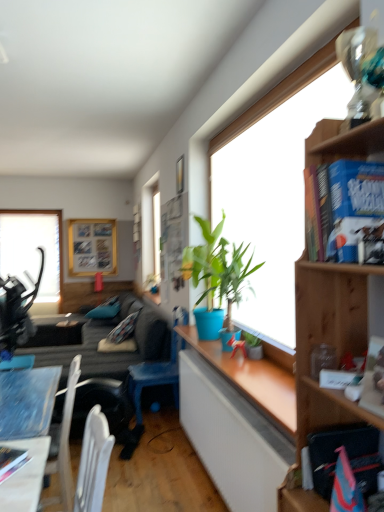
How much space does green matte plant at window, which is the second houseplant in top-to-bottom order, occupy vertically?

green matte plant at window, which is the second houseplant in top-to-bottom order, is 5.70 inches tall.

You are a GUI agent. You are given a task and a screenshot of the screen. Output one action in this format:
    pyautogui.click(x=<x>, y=<y>)
    Task: Click on the blue hardcover book at upper right, which is the 1th book from front to back
    
    Given the screenshot: What is the action you would take?
    pyautogui.click(x=354, y=202)

This screenshot has width=384, height=512. Identify the location of blue plastic chair at lower center. (155, 376).

This screenshot has height=512, width=384. I want to click on wooden desk at lower left, so click(26, 429).

This screenshot has height=512, width=384. What are the coordinates of `green matte plant at window, positioned as the 1th houseplant in bottom-to-top order` in the screenshot? It's located at (253, 346).

Considering the relative sizes of blue matte plant at center, marked as the second houseplant in a bottom-to-top arrangement, and dark gray fabric couch at lower left in the image provided, is blue matte plant at center, marked as the second houseplant in a bottom-to-top arrangement, wider than dark gray fabric couch at lower left?

No.

In the scene shown: Is blue matte plant at center, arranged as the second houseplant when viewed from the back, behind dark gray fabric couch at lower left?

No, blue matte plant at center, arranged as the second houseplant when viewed from the back, is in front of dark gray fabric couch at lower left.

Is blue matte plant at center, positioned as the 1th houseplant in top-to-bottom order, not near dark gray fabric couch at lower left?

Yes, blue matte plant at center, positioned as the 1th houseplant in top-to-bottom order, and dark gray fabric couch at lower left are quite far apart.

Is dark gray fabric couch at lower left spatially inside green matte plant at window, positioned as the 1th houseplant in bottom-to-top order, or outside of it?

dark gray fabric couch at lower left exists outside the volume of green matte plant at window, positioned as the 1th houseplant in bottom-to-top order.

Considering the sizes of objects dark gray fabric couch at lower left and green matte plant at window, which appears as the first houseplant when viewed from the back, in the image provided, who is bigger, dark gray fabric couch at lower left or green matte plant at window, which appears as the first houseplant when viewed from the back,?

Bigger between the two is dark gray fabric couch at lower left.

From a real-world perspective, is dark gray fabric couch at lower left over green matte plant at window, which is the second houseplant in top-to-bottom order?

No, from a real-world perspective, dark gray fabric couch at lower left is not above green matte plant at window, which is the second houseplant in top-to-bottom order.

You are a GUI agent. You are given a task and a screenshot of the screen. Output one action in this format:
    pyautogui.click(x=<x>, y=<y>)
    Task: Click on the 1st houseplant in front when counting from the dark gray fabric couch at lower left
    This screenshot has width=384, height=512.
    Given the screenshot: What is the action you would take?
    pyautogui.click(x=253, y=346)

Who is taller, transparent glass window at upper left or blue matte plant at center, placed as the first houseplant when sorted from front to back?

Standing taller between the two is transparent glass window at upper left.

Is blue matte plant at center, arranged as the second houseplant when viewed from the back, at the back of transparent glass window at upper left?

No.

Is transparent glass window at upper left at the right side of blue matte plant at center, positioned as the 1th houseplant in top-to-bottom order?

Incorrect, transparent glass window at upper left is not on the right side of blue matte plant at center, positioned as the 1th houseplant in top-to-bottom order.

Looking at this image, from a real-world perspective, is wooden picture frame at upper left beneath wooden desk at lower left?

Incorrect, from a real-world perspective, wooden picture frame at upper left is higher than wooden desk at lower left.

Which object is further away from the camera taking this photo, wooden picture frame at upper left or wooden desk at lower left?

wooden picture frame at upper left.

Considering the positions of objects wooden picture frame at upper left and wooden desk at lower left in the image provided, who is more to the left, wooden picture frame at upper left or wooden desk at lower left?

From the viewer's perspective, wooden picture frame at upper left appears more on the left side.

Is hardcover book at lower left, which ranks as the third book in front-to-back order, a part of wooden picture frame at upper left?

Definitely not — hardcover book at lower left, which ranks as the third book in front-to-back order, is not inside wooden picture frame at upper left.

Could you tell me if wooden picture frame at upper left is facing hardcover book at lower left, the 3th book viewed from the top?

Yes, wooden picture frame at upper left is facing hardcover book at lower left, the 3th book viewed from the top.

From a real-world perspective, is wooden picture frame at upper left on top of hardcover book at lower left, the 3th book from the right?

Yes, from a real-world perspective, wooden picture frame at upper left is over hardcover book at lower left, the 3th book from the right

Which is behind, wooden picture frame at upper left or hardcover book at lower left, the 3th book from the right?

wooden picture frame at upper left.

Who is smaller, wooden picture frame at upper left or blue plastic chair at lower center?

With smaller size is wooden picture frame at upper left.

Does wooden picture frame at upper left appear on the left side of blue plastic chair at lower center?

Yes, wooden picture frame at upper left is to the left of blue plastic chair at lower center.

Is blue plastic chair at lower center at the back of wooden picture frame at upper left?

No, blue plastic chair at lower center is not at the back of wooden picture frame at upper left.

Considering the positions of objects wooden desk at lower left and green matte plant at window, the 2th houseplant when ordered from front to back, in the image provided, who is behind, wooden desk at lower left or green matte plant at window, the 2th houseplant when ordered from front to back,?

green matte plant at window, the 2th houseplant when ordered from front to back, is more distant.

Consider the image. Does wooden desk at lower left appear on the right side of green matte plant at window, positioned as the 1th houseplant in bottom-to-top order?

In fact, wooden desk at lower left is to the left of green matte plant at window, positioned as the 1th houseplant in bottom-to-top order.

From the image's perspective, is wooden desk at lower left positioned above or below green matte plant at window, which appears as the first houseplant when viewed from the back?

wooden desk at lower left is situated lower than green matte plant at window, which appears as the first houseplant when viewed from the back, in the image.

From a real-world perspective, is wooden desk at lower left on green matte plant at window, positioned as the 1th houseplant in bottom-to-top order?

No, from a real-world perspective, wooden desk at lower left is not above green matte plant at window, positioned as the 1th houseplant in bottom-to-top order.

Find the location of a particular element. The width and height of the screenshot is (384, 512). studio couch on the left of blue matte plant at center, arranged as the second houseplant when viewed from the back is located at coordinates (99, 341).

At what (x,y) coordinates should I click in order to perform the action: click on the 1st houseplant in front of the dark gray fabric couch at lower left, starting your count from the anchor. Please return your answer as a coordinate pair (x, y). Looking at the image, I should click on (253, 346).

Looking at the image, which one is located closer to blue plastic chair at lower center, blue matte plant at center, marked as the second houseplant in a bottom-to-top arrangement, or dark gray fabric couch at lower left?

The object closer to blue plastic chair at lower center is dark gray fabric couch at lower left.

Looking at the image, which one is located further to wooden picture frame at upper left, blue matte plant at center, placed as the first houseplant when sorted from front to back, or hardcover book at center-right, which ranks as the third book in left-to-right order?

Among the two, hardcover book at center-right, which ranks as the third book in left-to-right order, is located further to wooden picture frame at upper left.

In the scene shown: Based on their spatial positions, is green matte plant at window, which is the second houseplant in top-to-bottom order, or transparent glass window at upper left closer to blue matte plant at center, marked as the second houseplant in a bottom-to-top arrangement?

The object closer to blue matte plant at center, marked as the second houseplant in a bottom-to-top arrangement, is green matte plant at window, which is the second houseplant in top-to-bottom order.

When comparing their distances from blue hardcover book at upper right, which is the 1th book from front to back, does hardcover book at center-right, marked as the second book in a front-to-back arrangement, or dark gray fabric couch at lower left seem further?

Based on the image, dark gray fabric couch at lower left appears to be further to blue hardcover book at upper right, which is the 1th book from front to back.

When comparing their distances from green matte plant at window, which appears as the first houseplant when viewed from the back, does hardcover book at lower left, marked as the 1th book in a bottom-to-top arrangement, or hardcover book at center-right, which is counted as the first book, starting from the right, seem further?

hardcover book at center-right, which is counted as the first book, starting from the right, is further to green matte plant at window, which appears as the first houseplant when viewed from the back.

When comparing their distances from hardcover book at lower left, the 3th book viewed from the top, does blue matte plant at center, marked as the second houseplant in a bottom-to-top arrangement, or dark gray fabric couch at lower left seem further?

dark gray fabric couch at lower left.

Considering their positions, is blue hardcover book at upper right, which appears as the third book when ordered from the bottom, positioned further to green matte plant at window, positioned as the 1th houseplant in bottom-to-top order, than dark gray fabric couch at lower left?

dark gray fabric couch at lower left is further to green matte plant at window, positioned as the 1th houseplant in bottom-to-top order.

From the image, which object appears to be nearer to wooden desk at lower left, blue matte plant at center, placed as the first houseplant when sorted from front to back, or hardcover book at center-right, marked as the second book in a front-to-back arrangement?

blue matte plant at center, placed as the first houseplant when sorted from front to back, lies closer to wooden desk at lower left than the other object.

The width and height of the screenshot is (384, 512). What are the coordinates of `chair located between green matte plant at window, which appears as the first houseplant when viewed from the back, and wooden picture frame at upper left in the depth direction` in the screenshot? It's located at (155, 376).

The width and height of the screenshot is (384, 512). Identify the location of desk between wooden bookshelf at upper right and green matte plant at window, positioned as the 1th houseplant in bottom-to-top order, in the front-back direction. (26, 429).

Identify the location of studio couch between wooden desk at lower left and wooden picture frame at upper left in the front-back direction. This screenshot has height=512, width=384. (99, 341).

Where is `studio couch between blue plastic chair at lower center and transparent glass window at upper left from front to back`? The width and height of the screenshot is (384, 512). studio couch between blue plastic chair at lower center and transparent glass window at upper left from front to back is located at coordinates (99, 341).